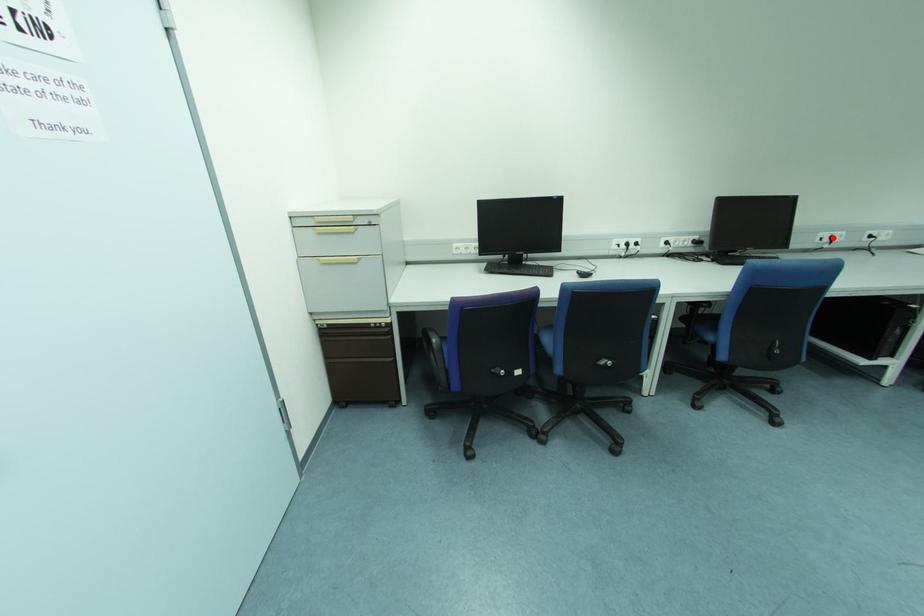
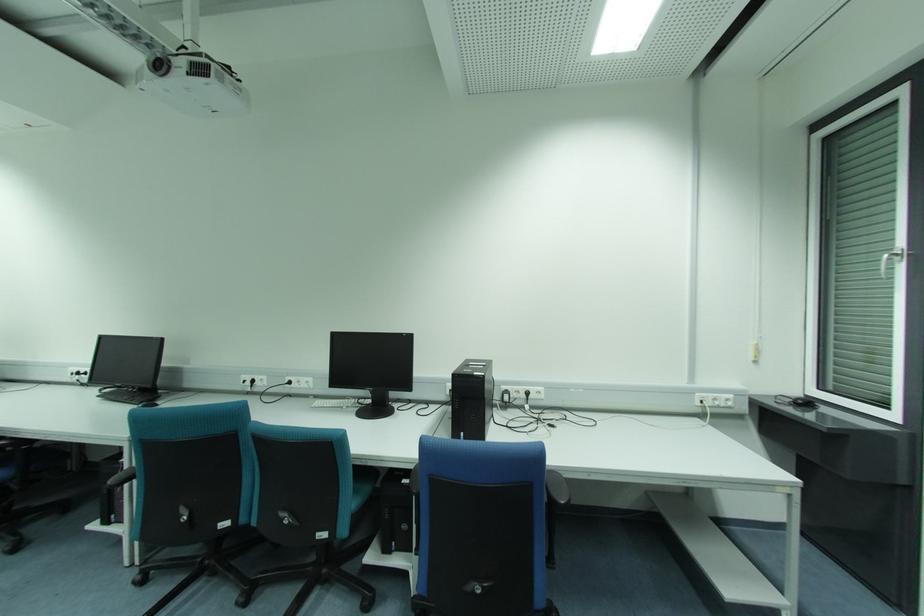
Where in the second image is the point corresponding to the highlighted location from the first image?

(253, 381)